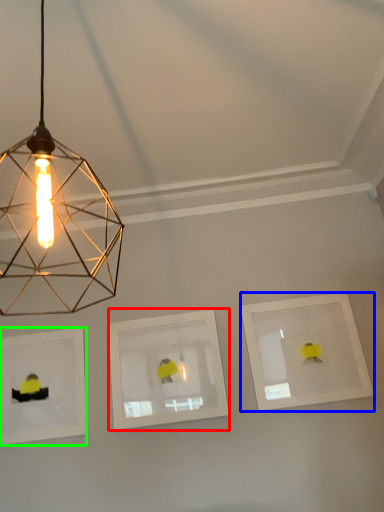
Question: Considering the real-world distances, which object is closest to picture frame (highlighted by a red box)? picture frame (highlighted by a blue box) or picture frame (highlighted by a green box).

Choices:
 (A) picture frame
 (B) picture frame

Answer: (B)